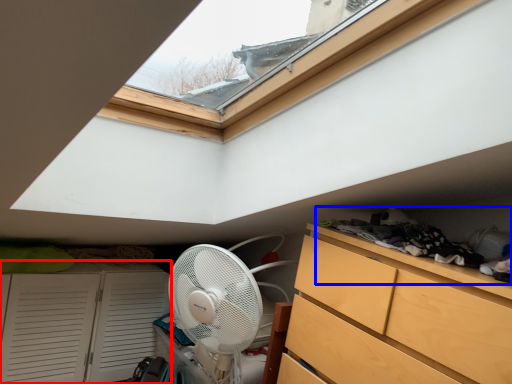
Question: Which object is further to the camera taking this photo, cupboard (highlighted by a red box) or laundry (highlighted by a blue box)?

Choices:
 (A) cupboard
 (B) laundry

Answer: (A)